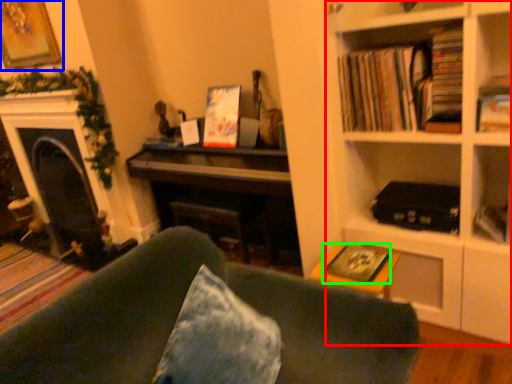
Question: Considering the real-world distances, which object is farthest from bookcase (highlighted by a red box)? picture frame (highlighted by a blue box) or paperback book (highlighted by a green box)?

Choices:
 (A) picture frame
 (B) paperback book

Answer: (A)